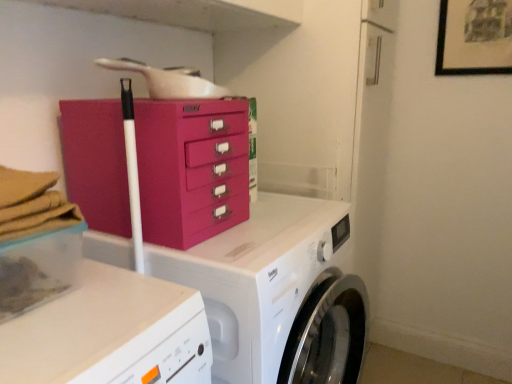
Question: From a real-world perspective, is fuchsia plastic chest of drawers at center physically above clear plastic container at lower left?

Choices:
 (A) no
 (B) yes

Answer: (B)

Question: Does fuchsia plastic chest of drawers at center appear on the left side of clear plastic container at lower left?

Choices:
 (A) yes
 (B) no

Answer: (B)

Question: Could you tell me if fuchsia plastic chest of drawers at center is turned towards clear plastic container at lower left?

Choices:
 (A) yes
 (B) no

Answer: (A)

Question: Are fuchsia plastic chest of drawers at center and clear plastic container at lower left located far from each other?

Choices:
 (A) yes
 (B) no

Answer: (B)

Question: Does fuchsia plastic chest of drawers at center have a lesser width compared to clear plastic container at lower left?

Choices:
 (A) yes
 (B) no

Answer: (A)

Question: In terms of height, does black matte picture frame at upper right look taller or shorter compared to white glossy washing machine at center?

Choices:
 (A) short
 (B) tall

Answer: (A)

Question: Considering the positions of point (475, 13) and point (325, 317), is point (475, 13) closer or farther from the camera than point (325, 317)?

Choices:
 (A) closer
 (B) farther

Answer: (B)

Question: From the image's perspective, relative to white glossy washing machine at center, is black matte picture frame at upper right above or below?

Choices:
 (A) below
 (B) above

Answer: (B)

Question: From a real-world perspective, is black matte picture frame at upper right positioned above or below white glossy washing machine at center?

Choices:
 (A) above
 (B) below

Answer: (A)

Question: From the image's perspective, is fuchsia plastic chest of drawers at center positioned above or below clear plastic container at lower left?

Choices:
 (A) above
 (B) below

Answer: (A)

Question: Visually, is fuchsia plastic chest of drawers at center positioned to the left or to the right of clear plastic container at lower left?

Choices:
 (A) left
 (B) right

Answer: (B)

Question: Is fuchsia plastic chest of drawers at center wider or thinner than clear plastic container at lower left?

Choices:
 (A) thin
 (B) wide

Answer: (A)

Question: Based on their sizes in the image, would you say fuchsia plastic chest of drawers at center is bigger or smaller than clear plastic container at lower left?

Choices:
 (A) small
 (B) big

Answer: (B)

Question: Is black matte picture frame at upper right taller or shorter than fuchsia plastic chest of drawers at center?

Choices:
 (A) short
 (B) tall

Answer: (A)

Question: Considering the positions of black matte picture frame at upper right and fuchsia plastic chest of drawers at center in the image, is black matte picture frame at upper right wider or thinner than fuchsia plastic chest of drawers at center?

Choices:
 (A) thin
 (B) wide

Answer: (A)